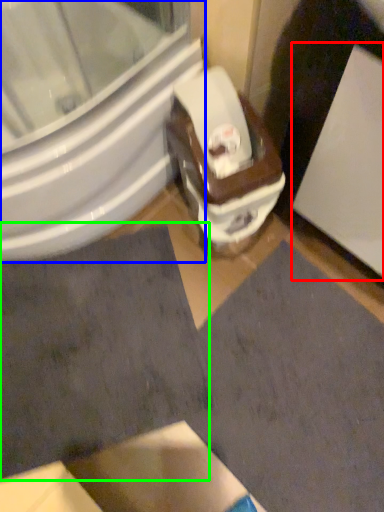
Question: Considering the real-world distances, which object is closest to screen door (highlighted by a red box)? bidet (highlighted by a blue box) or square (highlighted by a green box).

Choices:
 (A) bidet
 (B) square

Answer: (A)